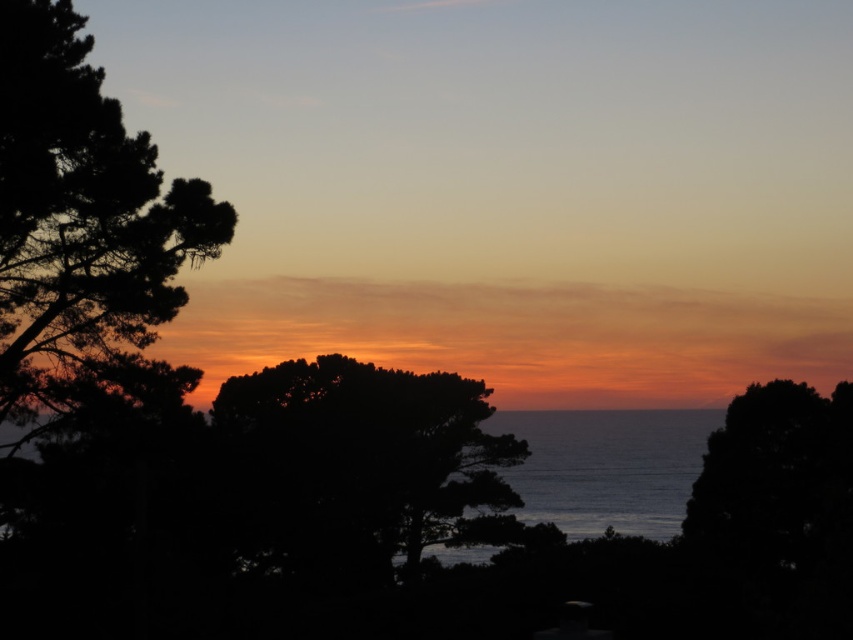
Question: Which of these objects is positioned closest to the dark green leafy tree at center?

Choices:
 (A) blue water at center
 (B) dark green leafy tree at left

Answer: (B)

Question: Does dark green leafy tree at center have a lesser width compared to blue water at center?

Choices:
 (A) no
 (B) yes

Answer: (B)

Question: Is dark green leafy tree at center further to the viewer compared to blue water at center?

Choices:
 (A) yes
 (B) no

Answer: (B)

Question: Considering the relative positions of dark green leafy tree at left and dark green leafy tree at center in the image provided, where is dark green leafy tree at left located with respect to dark green leafy tree at center?

Choices:
 (A) left
 (B) right

Answer: (A)

Question: Which of the following is the farthest from the observer?

Choices:
 (A) blue water at center
 (B) dark green leafy tree at center
 (C) dark green leafy tree at left

Answer: (A)

Question: Among these points, which one is farthest from the camera?

Choices:
 (A) (64, 353)
 (B) (577, 448)
 (C) (389, 385)

Answer: (B)